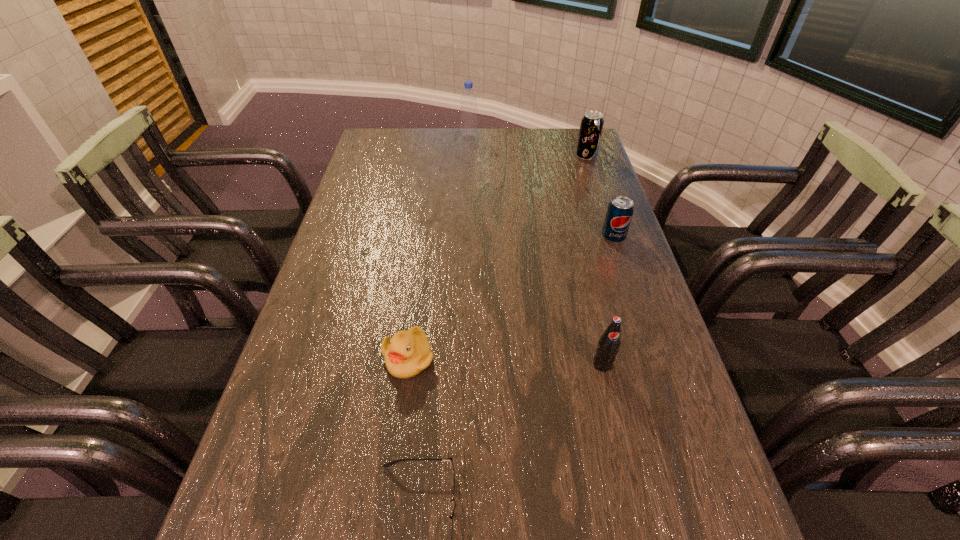
The height and width of the screenshot is (540, 960). What are the coordinates of `the tallest object` in the screenshot? It's located at pyautogui.click(x=469, y=130).

Locate an element on the screen. The width and height of the screenshot is (960, 540). bottle is located at coordinates [x=469, y=130].

Where is `the farthest soda can`? This screenshot has height=540, width=960. the farthest soda can is located at coordinates (591, 126).

At what (x,y) coordinates should I click in order to perform the action: click on the third object from right to left. Please return your answer as a coordinate pair (x, y). The image size is (960, 540). Looking at the image, I should click on [x=609, y=343].

Where is `the nearest soda can`? the nearest soda can is located at coordinates (609, 343).

Locate an element on the screen. This screenshot has width=960, height=540. the second nearest soda can is located at coordinates (620, 210).

This screenshot has height=540, width=960. In order to click on the third shortest object in this screenshot , I will do `click(620, 210)`.

This screenshot has width=960, height=540. I want to click on duckling, so click(407, 353).

Identify the location of free space located on the right of the bottle. The width and height of the screenshot is (960, 540). (516, 138).

At what (x,y) coordinates should I click in order to perform the action: click on vacant space located on the left of the fifth nearest object. Please return your answer as a coordinate pair (x, y). Image resolution: width=960 pixels, height=540 pixels. Looking at the image, I should click on (553, 157).